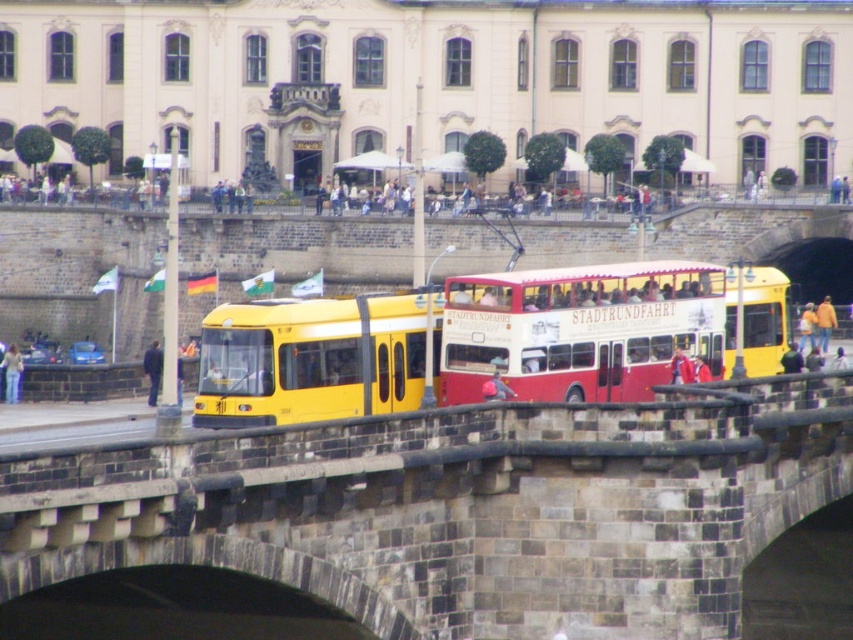
Question: Observing the image, what is the correct spatial positioning of stone bridge at center in reference to black fabric jacket at left?

Choices:
 (A) below
 (B) above

Answer: (A)

Question: Is stone bridge at center further to camera compared to denim jeans at lower left?

Choices:
 (A) no
 (B) yes

Answer: (A)

Question: Which object appears farthest from the camera in this image?

Choices:
 (A) matte red jacket at center
 (B) red matte double-decker bus at center

Answer: (B)

Question: Which object appears closest to the camera in this image?

Choices:
 (A) black fabric jacket at left
 (B) yellow matte bus at center
 (C) yellow matte tram at center
 (D) stone bridge at center

Answer: (D)

Question: Can you confirm if stone bridge at center is positioned to the right of black fabric jacket at left?

Choices:
 (A) no
 (B) yes

Answer: (B)

Question: Which of the following is the closest to the observer?

Choices:
 (A) red matte double-decker bus at center
 (B) denim jeans at lower left
 (C) yellow matte tram at center

Answer: (C)